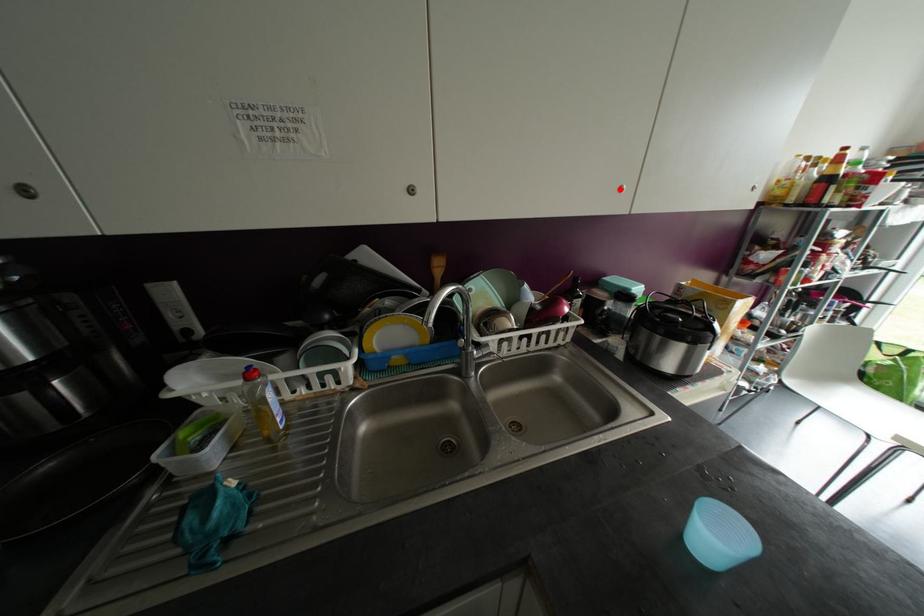
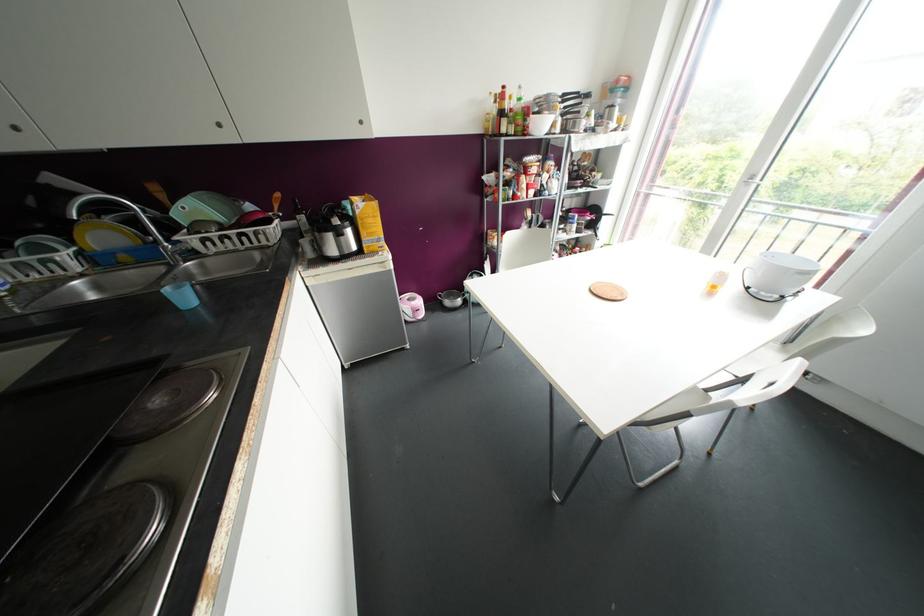
Find the pixel in the second image that matches the highlighted location in the first image.

(219, 124)